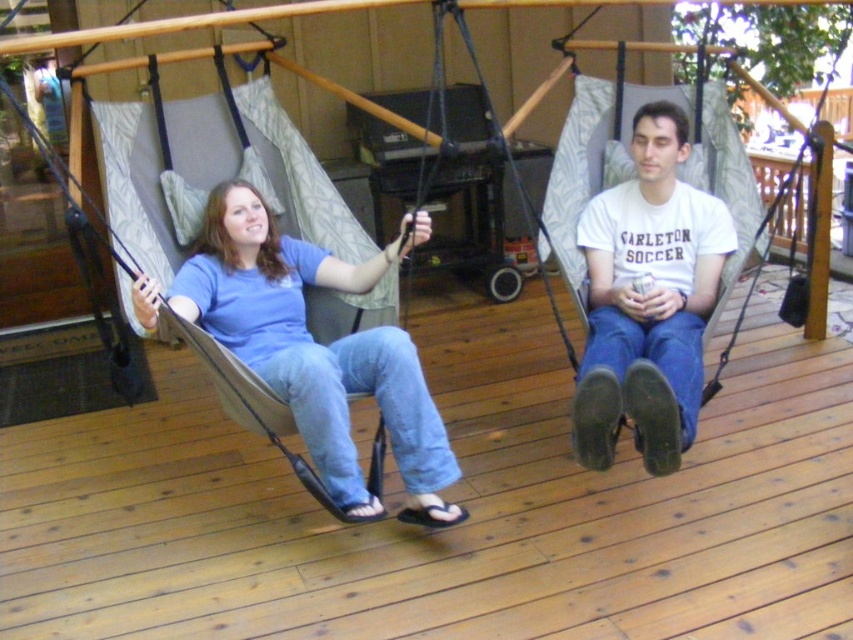
Question: Estimate the real-world distances between objects in this image. Which object is closer to the wooden deck at center?

Choices:
 (A) blue cotton shirt at center
 (B) matte gray hammock at left
 (C) white cotton shirt at center

Answer: (A)

Question: Is blue cotton shirt at center closer to the viewer compared to white cotton shirt at center?

Choices:
 (A) yes
 (B) no

Answer: (B)

Question: Which point is farther to the camera?

Choices:
 (A) (633, 282)
 (B) (276, 269)
 (C) (39, 486)
 (D) (202, 358)

Answer: (C)

Question: Can you confirm if blue cotton shirt at center is positioned to the left of white cotton shirt at center?

Choices:
 (A) no
 (B) yes

Answer: (B)

Question: Is wooden deck at center below blue cotton shirt at center?

Choices:
 (A) yes
 (B) no

Answer: (A)

Question: Which is nearer to the matte gray hammock at left?

Choices:
 (A) wooden deck at center
 (B) white cotton shirt at center

Answer: (A)